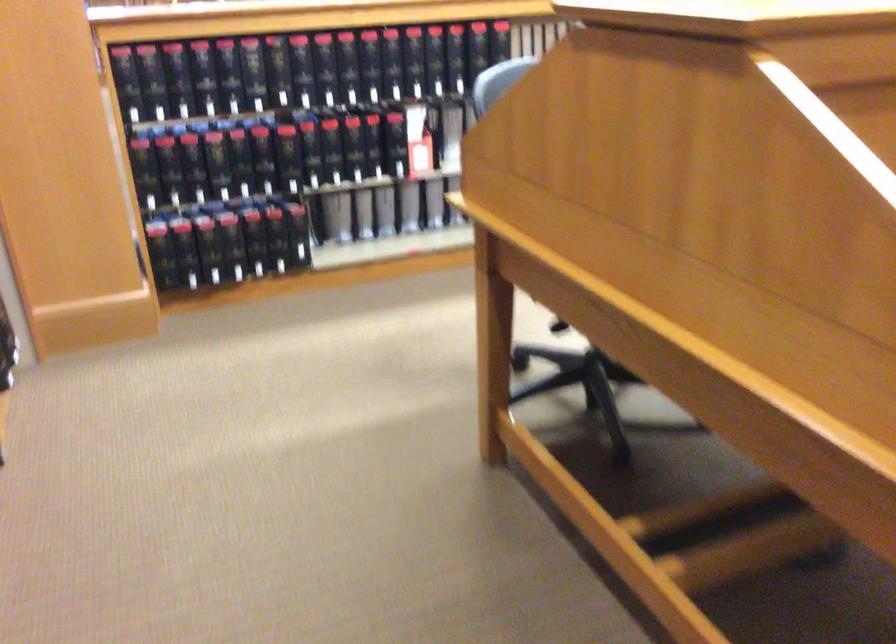
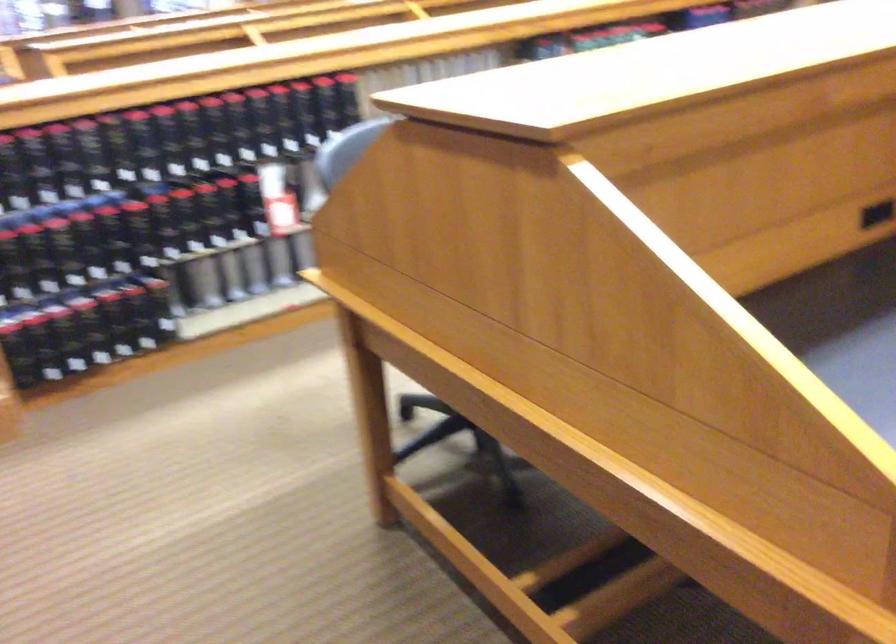
Question: The camera is either moving clockwise (left) or counter-clockwise (right) around the object. The first image is from the beginning of the video and the second image is from the end. Is the camera moving left or right when shooting the video?

Choices:
 (A) Left
 (B) Right

Answer: (A)